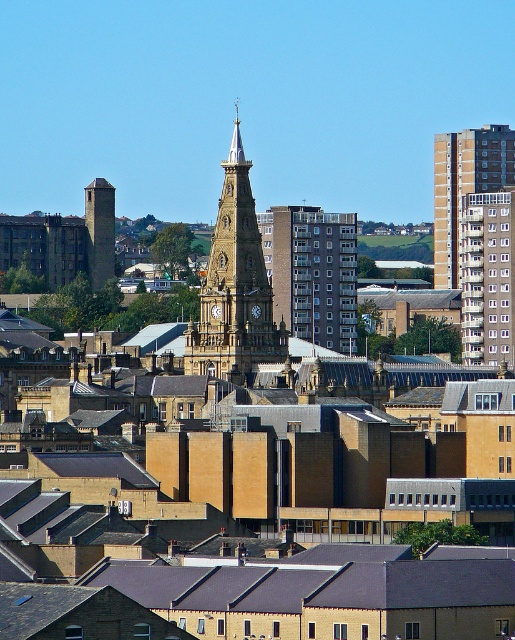
You are standing in the city square and want to take a photo of both the golden stone clock tower at center and the brown concrete building at upper right. Which object should you position closer to the front of your camera frame to ensure both are in the shot?

You should position the golden stone clock tower at center closer to the front of your camera frame because it is closer to the viewer than the brown concrete building at upper right, ensuring both appear in the shot without one being cut off.

You are a drone operator tasked with capturing aerial footage of the city. Your drone has a maximum flight range of 80 meters. If you are currently positioned at the golden stone clock tower at center, can you fly your drone to the brown concrete building at upper right without exceeding its range?

The distance between the golden stone clock tower at center and the brown concrete building at upper right is 85.77 meters, which exceeds the drone maximum flight range of 80 meters. Therefore, the drone cannot reach the brown concrete building at upper right without exceeding its range.